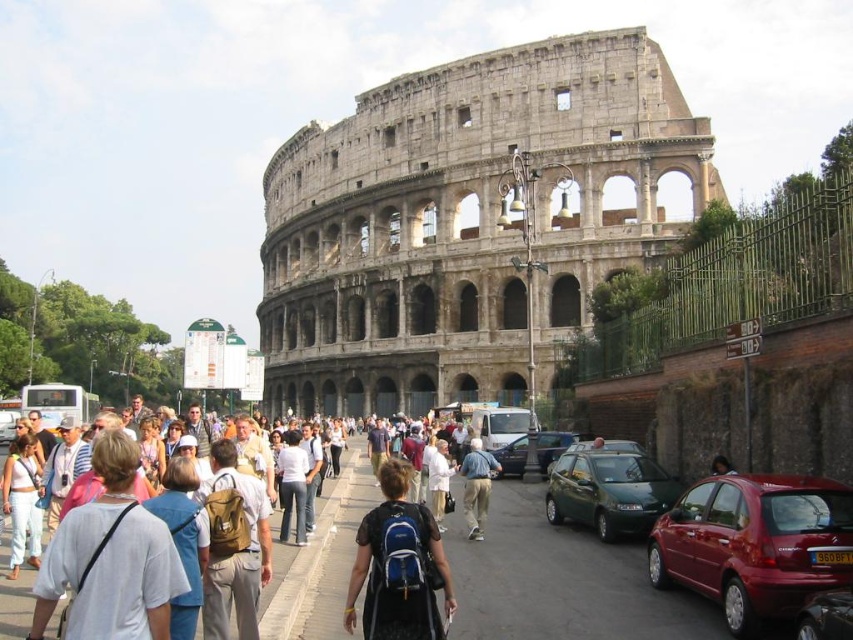
Does white cotton shirt at center have a greater height compared to metallic gray sedan at center?

Yes.

Is white cotton shirt at center behind metallic gray sedan at center?

No, it is not.

Identify the location of white cotton shirt at center. Image resolution: width=853 pixels, height=640 pixels. (292, 484).

Between stone amphitheater at center and metallic gray sedan at center, which one has more height?

stone amphitheater at center is taller.

Is stone amphitheater at center shorter than metallic gray sedan at center?

No.

This screenshot has height=640, width=853. I want to click on stone amphitheater at center, so click(468, 221).

Where is `stone amphitheater at center`? The height and width of the screenshot is (640, 853). stone amphitheater at center is located at coordinates (468, 221).

Who is lower down, stone amphitheater at center or white cotton shirt at center?

white cotton shirt at center

Between stone amphitheater at center and white cotton shirt at center, which one appears on the left side from the viewer's perspective?

white cotton shirt at center

Which is in front, point (410, 320) or point (291, 467)?

Point (291, 467) is in front.

Where is `stone amphitheater at center`? This screenshot has height=640, width=853. stone amphitheater at center is located at coordinates (468, 221).